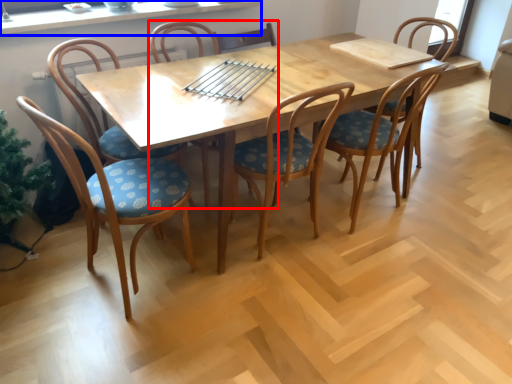
Question: Which point is further to the camera, chair (highlighted by a red box) or window sill (highlighted by a blue box)?

Choices:
 (A) chair
 (B) window sill

Answer: (B)